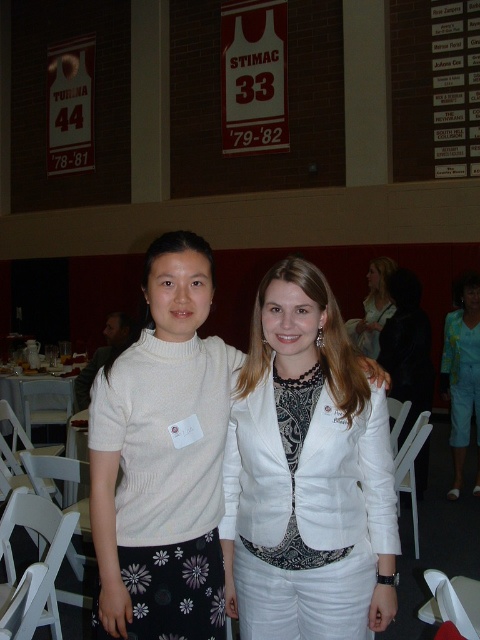
You are standing in the gymnasium and want to take a photo of the point located at coordinates point (182, 333). If your camera has a focal length of 50mm and you are 4.77 feet away from the point, what is the required distance in feet between you and the point to ensure it fills the frame properly?

The point (182, 333) is already 4.77 feet away from the viewer, so maintaining that distance ensures it fills the frame properly with the given camera settings.

You are standing in the gymnasium and want to find the white matte sweater at center. Based on the coordinates provided, which object is located at point (163, 458)?

The point (163, 458) corresponds to the white matte sweater at center.

You are standing in the gymnasium and need to locate the white leather blazer at center. According to the coordinates provided, where exactly is it positioned?

The white leather blazer at center is located at point coordinates 0.736 on the x axis and 0.633 on the y axis.